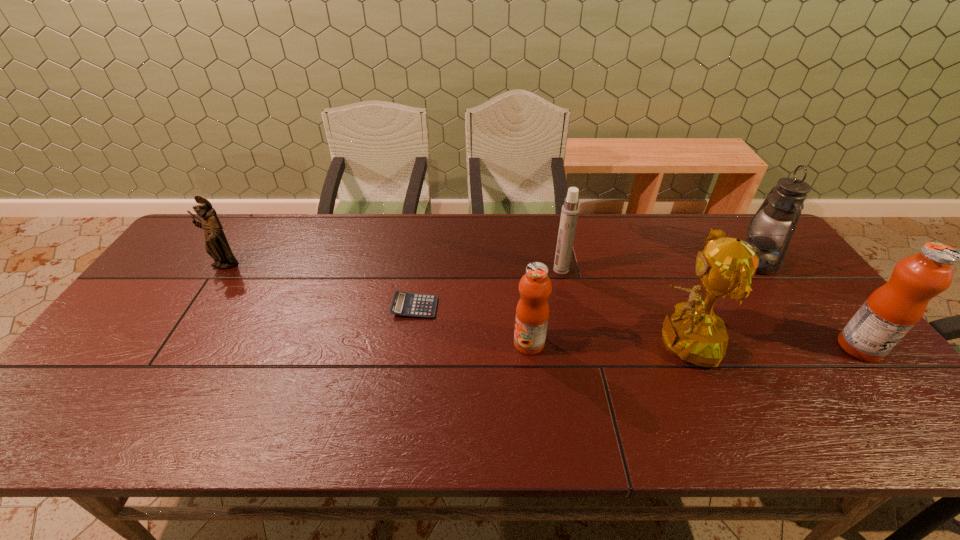
Identify the location of vacant region located on the front label of the shorter fruit juice. The image size is (960, 540). (459, 343).

I want to click on vacant area situated 0.240m on the front label of the shorter fruit juice, so click(420, 343).

Locate an element on the screen. free location located on the right of the fourth object from left to right is located at coordinates (618, 269).

Locate an element on the screen. This screenshot has width=960, height=540. vacant space located 0.150m on the left of the sixth object from right to left is located at coordinates (338, 307).

The width and height of the screenshot is (960, 540). I want to click on free space located 0.190m on the left of the oil lamp, so click(x=671, y=261).

The image size is (960, 540). Identify the location of free region located 0.340m on the front side of the third object from right to left. click(505, 342).

At what (x,y) coordinates should I click in order to perform the action: click on blank space located on the front side of the third object from right to left. Please return your answer as a coordinate pair (x, y). Looking at the image, I should click on (590, 342).

Where is `free spot located 0.090m on the front side of the third object from right to left`? This screenshot has height=540, width=960. free spot located 0.090m on the front side of the third object from right to left is located at coordinates (603, 342).

Locate an element on the screen. blank space located 0.240m on the front-facing side of the figurine is located at coordinates (177, 337).

Find the location of a particular element. This screenshot has width=960, height=540. oil lamp at the far edge is located at coordinates (774, 223).